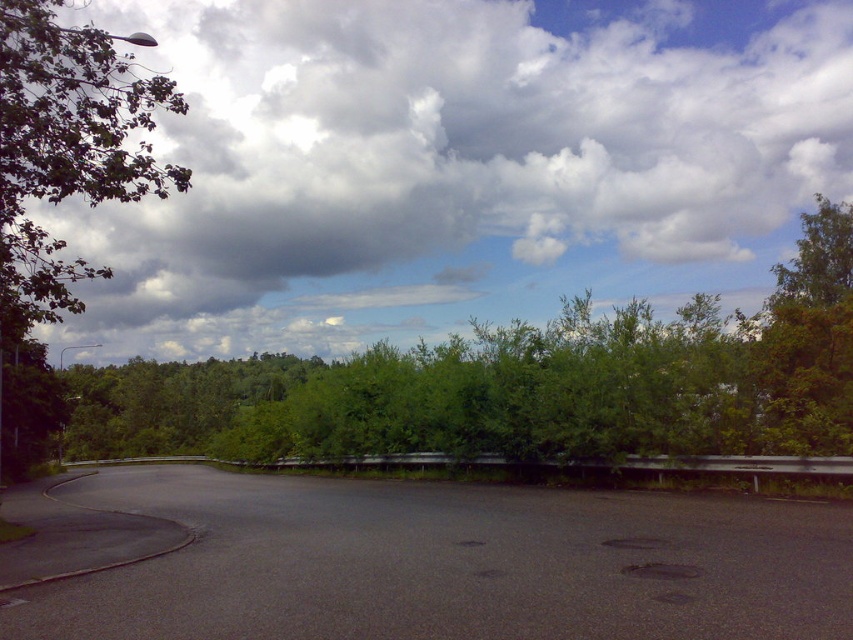
You are standing on the side of the road and want to cross the black asphalt highway at center. The safety regulations require that you must be at least 5 meters away from the road to be considered safe. Are you within a safe distance?

The black asphalt highway at center is 4.99 meters away from viewer, which is less than the required 5 meters. Therefore, you are not within a safe distance according to the regulations.

You are a driver approaching the black asphalt highway at center and see the green leafy tree at left in your side mirror. Which object is nearer to your current position?

The black asphalt highway at center is closer to the viewer than the green leafy tree at left, so the black asphalt highway at center is nearer to your current position.

You are a driver approaching the black asphalt highway at center. You notice the cloudy sky at upper center. From your perspective, which object is positioned to the right side?

The cloudy sky at upper center is to the right of the black asphalt highway at center, so the cloudy sky at upper center is positioned to the right side.